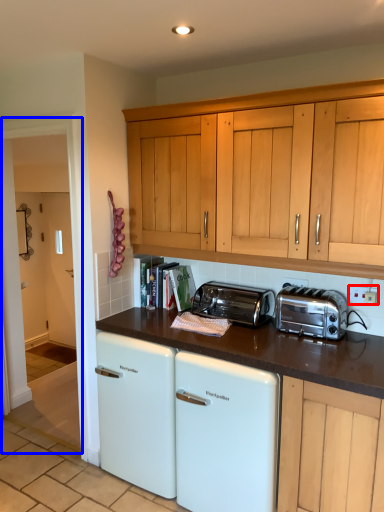
Question: Which object appears closest to the camera in this image, electric outlet (highlighted by a red box) or glass door (highlighted by a blue box)?

Choices:
 (A) electric outlet
 (B) glass door

Answer: (A)